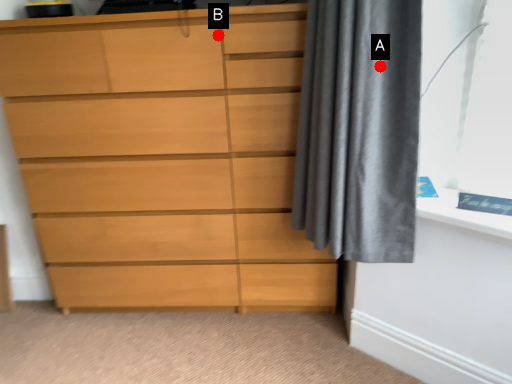
Question: Two points are circled on the image, labeled by A and B beside each circle. Among these points, which one is farthest from the camera?

Choices:
 (A) A is further
 (B) B is further

Answer: (B)